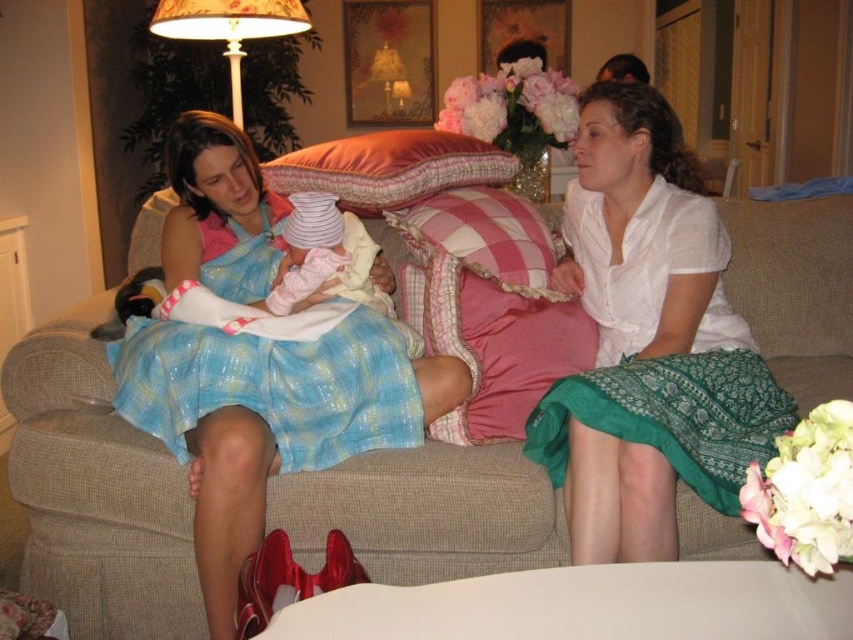
From the picture: Who is positioned more to the left, blue plaid dress at left or pink velvety pillow at center?

blue plaid dress at left is more to the left.

This screenshot has height=640, width=853. Find the location of `blue plaid dress at left`. blue plaid dress at left is located at coordinates (268, 369).

Image resolution: width=853 pixels, height=640 pixels. I want to click on blue plaid dress at left, so click(x=268, y=369).

Which is more to the right, white cotton shirt at center or pink plaid pillow at center?

From the viewer's perspective, white cotton shirt at center appears more on the right side.

Who is higher up, white cotton shirt at center or pink plaid pillow at center?

pink plaid pillow at center is above.

Which is behind, point (605, 99) or point (440, 236)?

Positioned behind is point (440, 236).

Identify the location of white cotton shirt at center. The width and height of the screenshot is (853, 640). (648, 340).

Between point (166, 616) and point (227, 51), which one is positioned behind?

The point (227, 51) is more distant.

Can you confirm if beige fabric couch at center is smaller than floral fabric lampshade at upper left?

Incorrect, beige fabric couch at center is not smaller in size than floral fabric lampshade at upper left.

Is point (323, 529) positioned in front of point (264, 3)?

Yes, it is in front of point (264, 3).

This screenshot has height=640, width=853. Find the location of `beige fabric couch at center`. beige fabric couch at center is located at coordinates (96, 492).